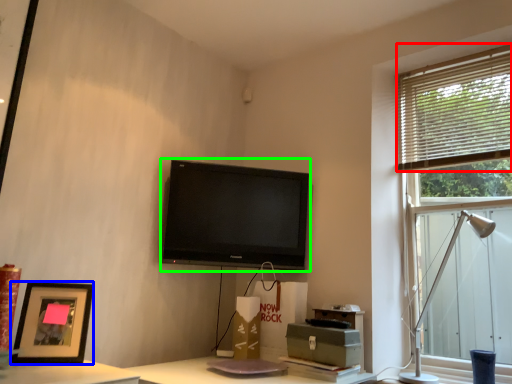
Question: Which is farther away from blind (highlighted by a red box)? picture frame (highlighted by a blue box) or television (highlighted by a green box)?

Choices:
 (A) picture frame
 (B) television

Answer: (A)